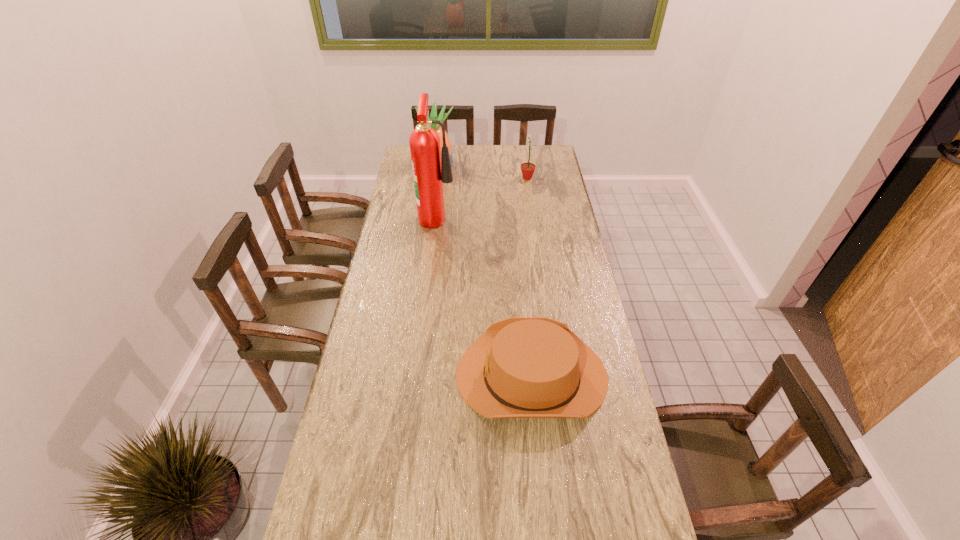
Identify the location of vacant space in between the sunflower and the cowboy hat. This screenshot has height=540, width=960. [x=529, y=276].

This screenshot has height=540, width=960. In order to click on empty space that is in between the shortest object and the sunflower in this screenshot , I will do `click(529, 276)`.

In order to click on free point between the third tallest object and the tallest object in this screenshot , I will do `click(482, 197)`.

At what (x,y) coordinates should I click in order to perform the action: click on object that is the nearest to the pineapple. Please return your answer as a coordinate pair (x, y). Looking at the image, I should click on (429, 171).

Image resolution: width=960 pixels, height=540 pixels. What are the coordinates of `the third closest object to the third tallest object` in the screenshot? It's located at (521, 367).